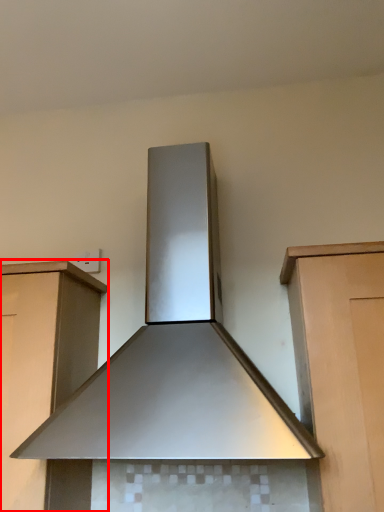
Question: From the image's perspective, what is the correct spatial relationship of cabinetry (annotated by the red box) in relation to home appliance?

Choices:
 (A) above
 (B) below

Answer: (B)